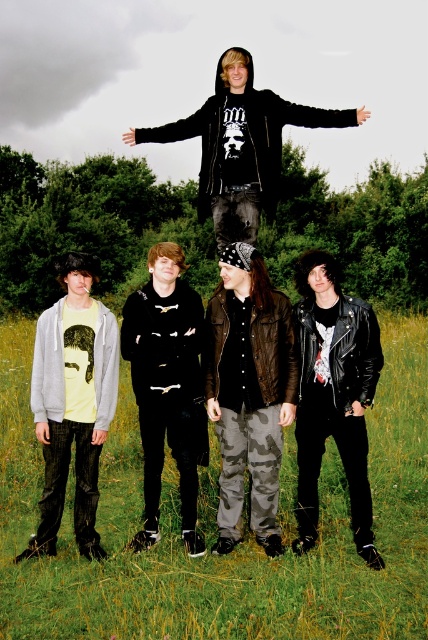
You are standing at the origin point of the image coordinate system. You want to move towards the point with coordinates point (109, 332) and point (315, 392). Which point will you reach first?

Point (315, 392) will be reached first because it is in front of point (109, 332).